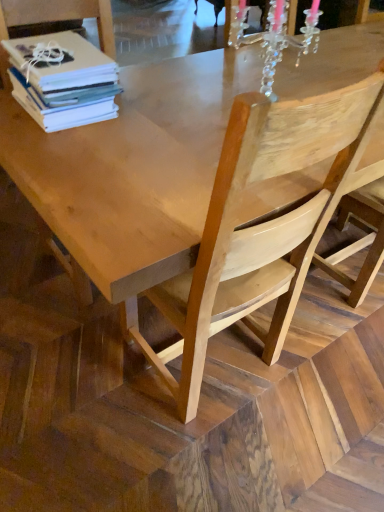
The height and width of the screenshot is (512, 384). What are the coordinates of `vacant area to the right of white paper stack at upper left` in the screenshot? It's located at (153, 118).